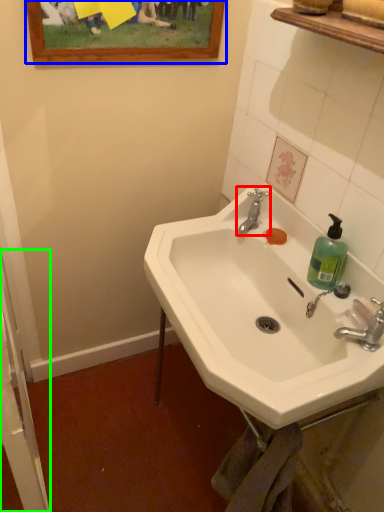
Question: Estimate the real-world distances between objects in this image. Which object is farther from tap (highlighted by a red box), picture frame (highlighted by a blue box) or screen door (highlighted by a green box)?

Choices:
 (A) picture frame
 (B) screen door

Answer: (B)